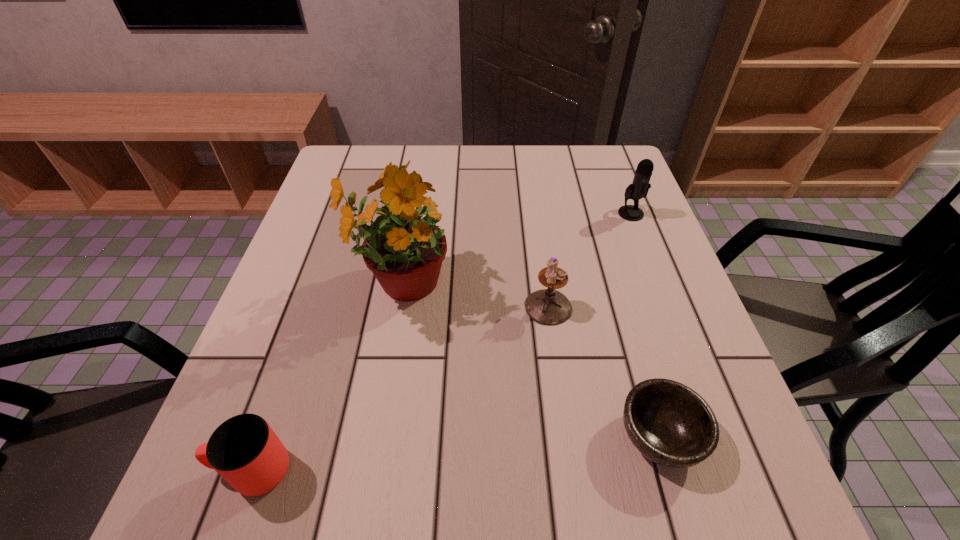
Locate an element on the screen. The width and height of the screenshot is (960, 540). free space located 0.120m on the left of the bowl is located at coordinates (543, 436).

I want to click on cup that is positioned at the near edge, so click(x=244, y=450).

Where is `bowl that is at the near edge`? Image resolution: width=960 pixels, height=540 pixels. bowl that is at the near edge is located at coordinates (669, 423).

Where is `flowerpot present at the left edge`? The width and height of the screenshot is (960, 540). flowerpot present at the left edge is located at coordinates (404, 247).

The image size is (960, 540). What are the coordinates of `cup that is at the left edge` in the screenshot? It's located at (244, 450).

Locate an element on the screen. microphone situated at the right edge is located at coordinates (639, 188).

What are the coordinates of `bowl that is at the right edge` in the screenshot? It's located at (669, 423).

Image resolution: width=960 pixels, height=540 pixels. Identify the location of object at the near left corner. (244, 450).

Where is `object that is at the near right corner`? This screenshot has width=960, height=540. object that is at the near right corner is located at coordinates point(669,423).

The width and height of the screenshot is (960, 540). In order to click on vacant region at the far edge of the desktop in this screenshot , I will do `click(522, 153)`.